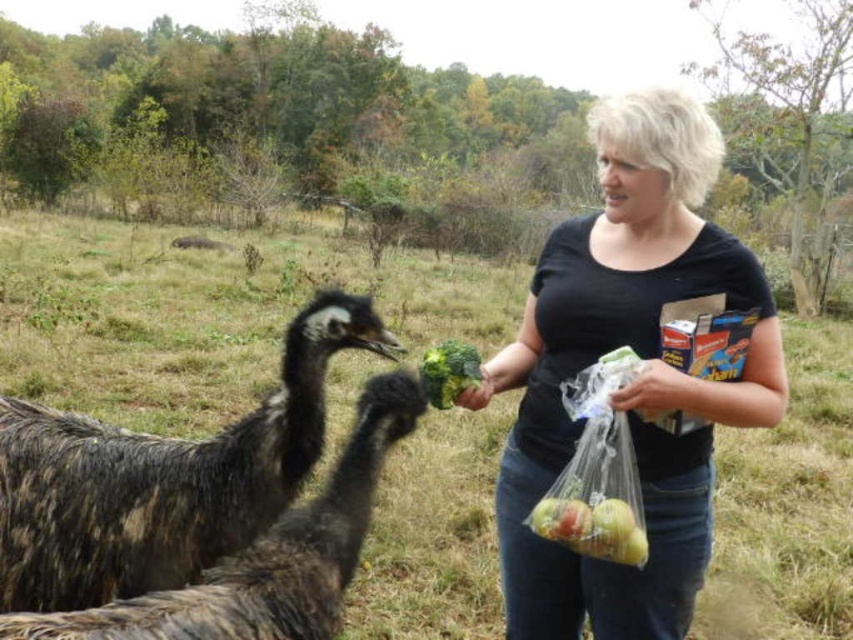
Question: Can you confirm if translucent plastic bag of apples at center is thinner than green broccoli at center?

Choices:
 (A) no
 (B) yes

Answer: (A)

Question: Which point is farther to the camera?

Choices:
 (A) shiny yellow apples at lower center
 (B) translucent plastic bag of apples at center
 (C) green broccoli at center

Answer: (C)

Question: Can you confirm if translucent plastic bag of apples at center is positioned to the left of shiny yellow apples at lower center?

Choices:
 (A) yes
 (B) no

Answer: (B)

Question: Which is nearer to the dark brown feathered ostrich at left?

Choices:
 (A) shiny yellow apples at lower center
 (B) black cotton t-shirt at center

Answer: (B)

Question: Which point is closer to the camera?

Choices:
 (A) shiny plastic bag of apples at center
 (B) shiny yellow apples at lower center
 (C) green broccoli at center
 (D) dark brown feathered ostrich at left

Answer: (A)

Question: Does green broccoli at center have a lesser width compared to shiny yellow apples at lower center?

Choices:
 (A) yes
 (B) no

Answer: (B)